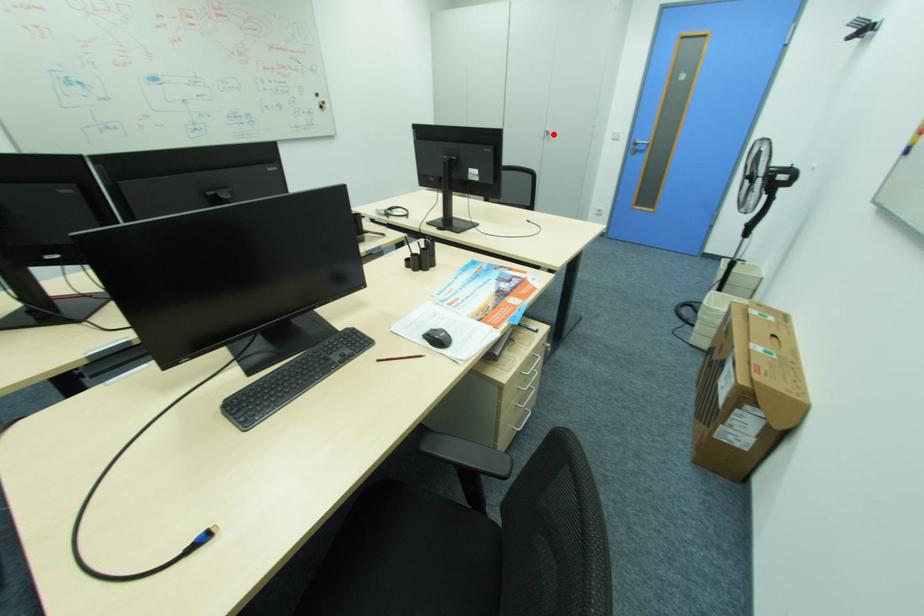
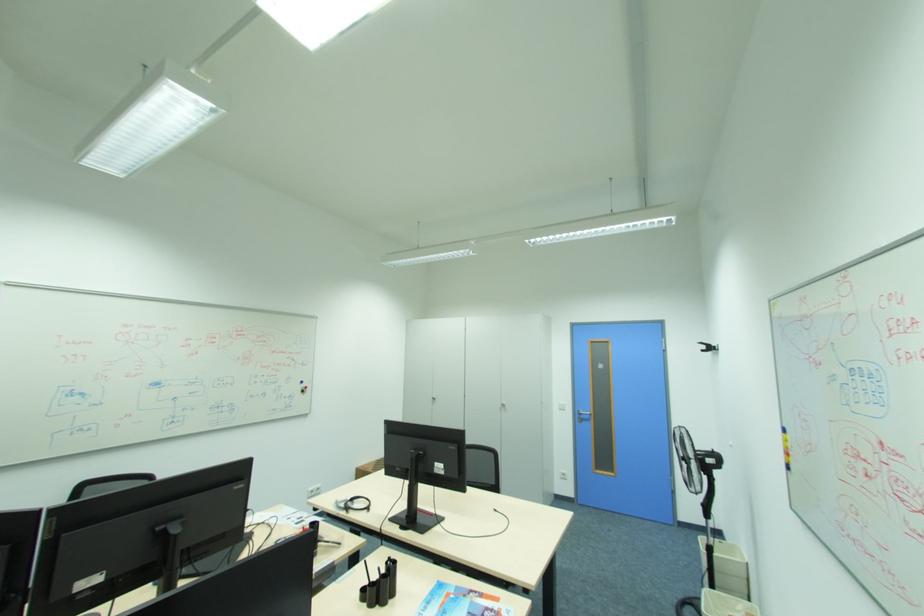
Find the pixel in the second image that matches the highlighted location in the first image.

(508, 406)